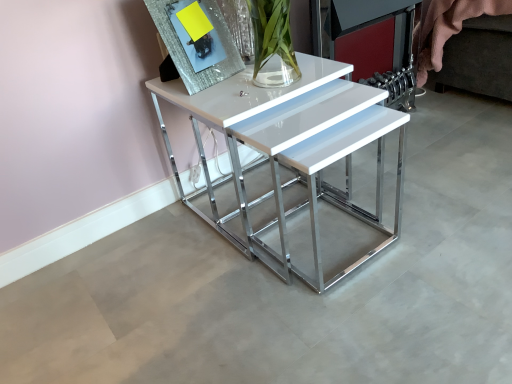
Question: Is point (198, 43) positioned closer to the camera than point (291, 158)?

Choices:
 (A) closer
 (B) farther

Answer: (B)

Question: Based on their sizes in the image, would you say sparkly silver picture frame at upper left is bigger or smaller than white glossy table at center?

Choices:
 (A) small
 (B) big

Answer: (A)

Question: From a real-world perspective, relative to white glossy table at center, is sparkly silver picture frame at upper left vertically above or below?

Choices:
 (A) above
 (B) below

Answer: (A)

Question: In terms of size, does white glossy table at center appear bigger or smaller than sparkly silver picture frame at upper left?

Choices:
 (A) big
 (B) small

Answer: (A)

Question: Does point (300, 208) appear closer or farther from the camera than point (179, 41)?

Choices:
 (A) farther
 (B) closer

Answer: (A)

Question: Would you say white glossy table at center is to the left or to the right of sparkly silver picture frame at upper left in the picture?

Choices:
 (A) right
 (B) left

Answer: (A)

Question: Looking at their shapes, would you say white glossy table at center is wider or thinner than sparkly silver picture frame at upper left?

Choices:
 (A) wide
 (B) thin

Answer: (A)